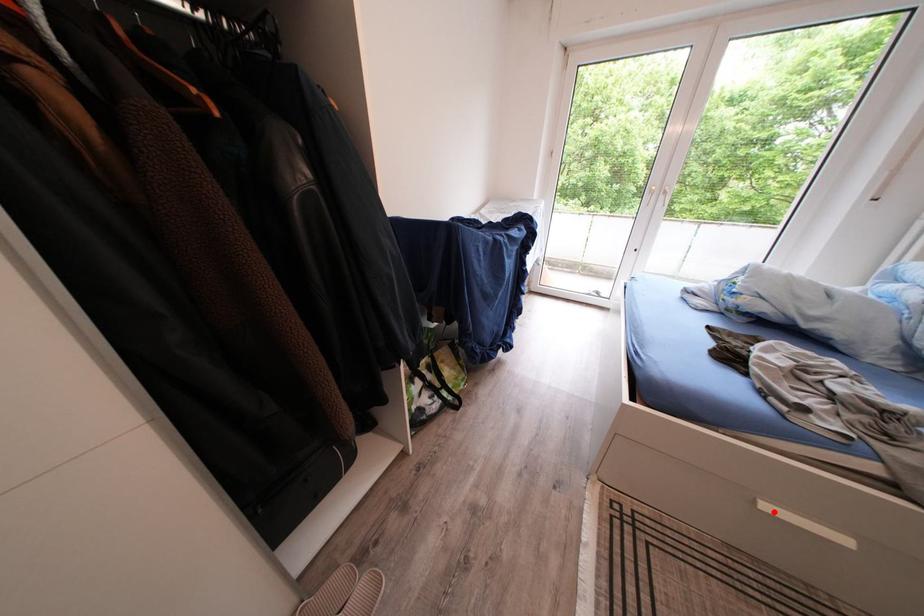
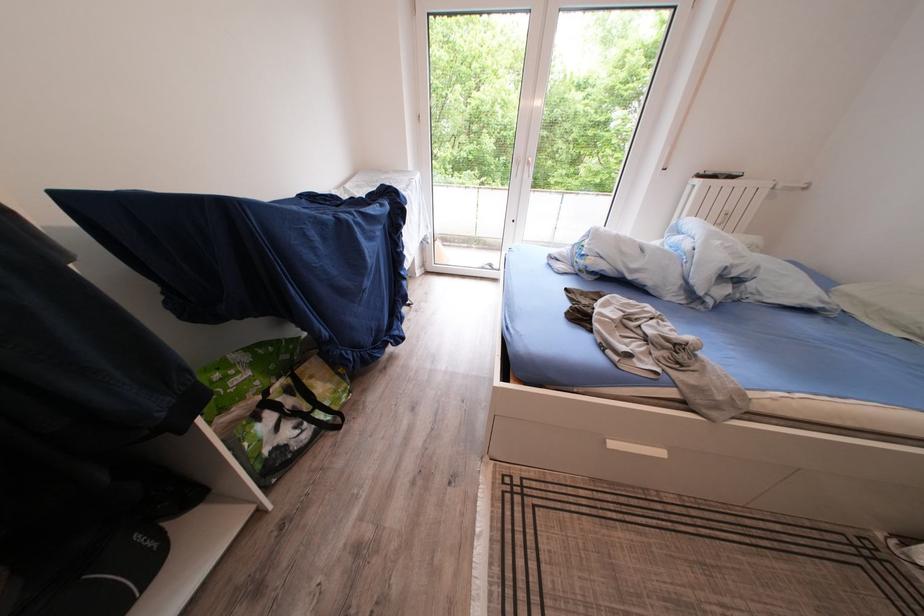
The point at the highlighted location is marked in the first image. Where is the corresponding point in the second image?

(621, 450)